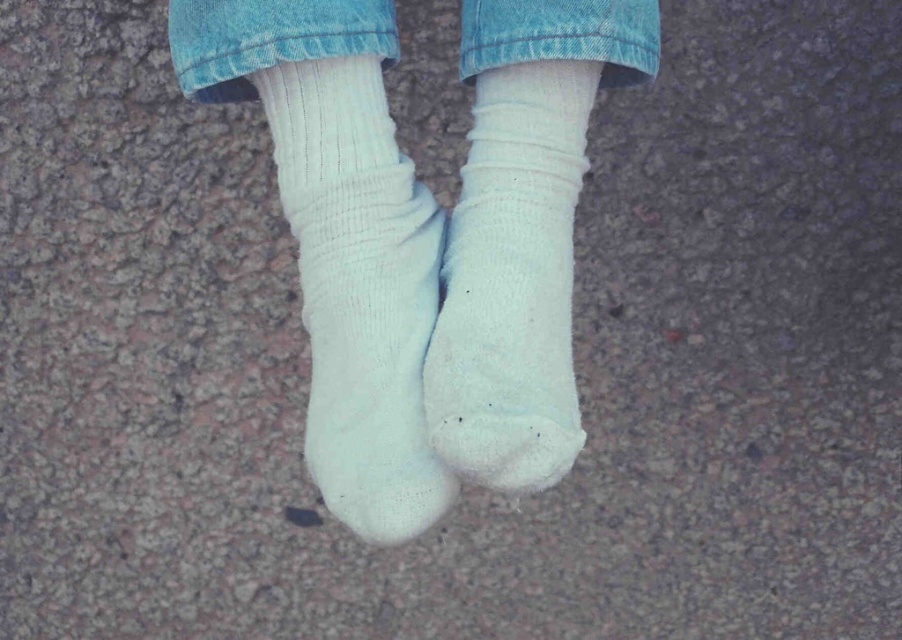
Image resolution: width=902 pixels, height=640 pixels. What do you see at coordinates (512, 282) in the screenshot?
I see `white knitted sock at center` at bounding box center [512, 282].

Is point (457, 268) positioned before point (532, 45)?

No, (457, 268) is behind (532, 45).

Locate an element on the screen. This screenshot has height=640, width=902. white knitted sock at center is located at coordinates (512, 282).

Locate an element on the screen. white knitted sock at center is located at coordinates (512, 282).

Who is positioned more to the right, white ribbed socks at center or white knitted sock at center?

Positioned to the right is white knitted sock at center.

Is white ribbed socks at center further to the viewer compared to white knitted sock at center?

No, white ribbed socks at center is in front of white knitted sock at center.

Is point (330, 145) closer to viewer compared to point (511, 225)?

Yes, it is in front of point (511, 225).

Locate an element on the screen. The image size is (902, 640). white ribbed socks at center is located at coordinates (425, 236).

Is white ribbed socks at center positioned before white ribbed sock at center?

Yes.

Find the location of a particular element. The width and height of the screenshot is (902, 640). white ribbed socks at center is located at coordinates (425, 236).

What are the coordinates of `white ribbed socks at center` in the screenshot? It's located at (425, 236).

Find the location of a particular element. This screenshot has height=640, width=902. white ribbed socks at center is located at coordinates (425, 236).